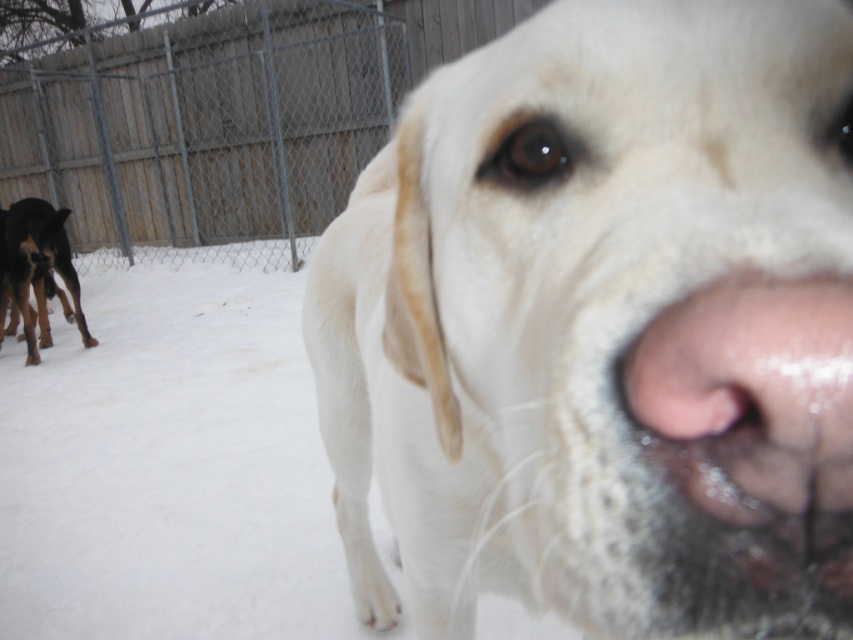
Is point (505, 365) closer to viewer compared to point (20, 218)?

Yes, it is.

Image resolution: width=853 pixels, height=640 pixels. What do you see at coordinates (604, 326) in the screenshot?
I see `white fur dog at center` at bounding box center [604, 326].

Who is more distant from viewer, (814, 609) or (33, 330)?

The point (33, 330) is behind.

Where is `white fur dog at center`? This screenshot has height=640, width=853. white fur dog at center is located at coordinates (604, 326).

Image resolution: width=853 pixels, height=640 pixels. I want to click on metal chain-link fence at upper left, so click(221, 120).

Is point (146, 243) closer to viewer compared to point (80, 336)?

No, it is not.

Image resolution: width=853 pixels, height=640 pixels. In order to click on metal chain-link fence at upper left in this screenshot , I will do `click(221, 120)`.

Who is lower down, white fur dog at center or metal chain-link fence at upper left?

white fur dog at center

Can you confirm if white fur dog at center is positioned above metal chain-link fence at upper left?

No.

Find the location of a particular element. The image size is (853, 640). white fur dog at center is located at coordinates (604, 326).